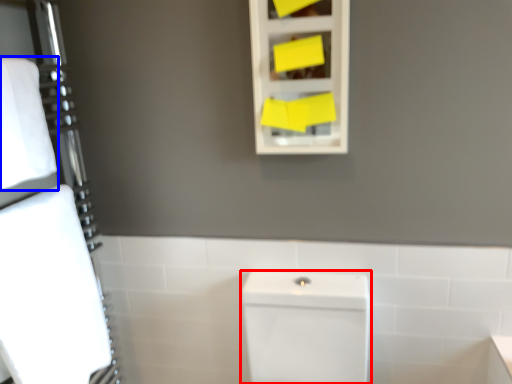
Question: Among these objects, which one is nearest to the camera, porcelain (highlighted by a red box) or bath towel (highlighted by a blue box)?

Choices:
 (A) porcelain
 (B) bath towel

Answer: (A)